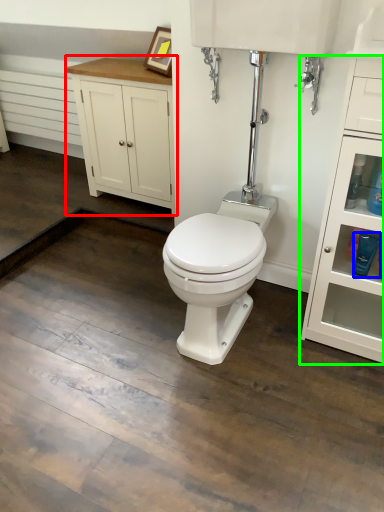
Question: Which object is the closest to the bathroom cabinet (highlighted by a red box)? Choose among these: toiletry (highlighted by a blue box) or dresser (highlighted by a green box).

Choices:
 (A) toiletry
 (B) dresser

Answer: (B)